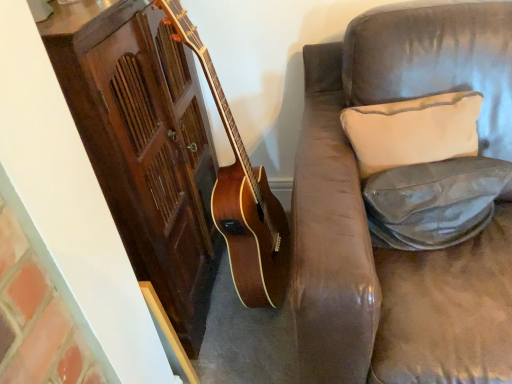
Question: Is white fabric pillow at upper right, marked as the first pillow in a top-to-bottom arrangement, next to leather-like gray pillow at right, the 2th pillow from the top, and touching it?

Choices:
 (A) yes
 (B) no

Answer: (A)

Question: Would you consider white fabric pillow at upper right, which appears as the second pillow when ordered from the bottom, to be distant from leather-like gray pillow at right, the 2th pillow from the top?

Choices:
 (A) yes
 (B) no

Answer: (B)

Question: From a real-world perspective, is white fabric pillow at upper right, marked as the first pillow in a top-to-bottom arrangement, physically above leather-like gray pillow at right, marked as the 1th pillow in a bottom-to-top arrangement?

Choices:
 (A) yes
 (B) no

Answer: (A)

Question: Is white fabric pillow at upper right, which appears as the second pillow when ordered from the bottom, at the right side of leather-like gray pillow at right, marked as the 1th pillow in a bottom-to-top arrangement?

Choices:
 (A) yes
 (B) no

Answer: (B)

Question: Is white fabric pillow at upper right, marked as the first pillow in a top-to-bottom arrangement, looking in the opposite direction of leather-like gray pillow at right, marked as the 1th pillow in a bottom-to-top arrangement?

Choices:
 (A) no
 (B) yes

Answer: (A)

Question: Considering the relative sizes of white fabric pillow at upper right, marked as the first pillow in a top-to-bottom arrangement, and leather-like gray pillow at right, marked as the 1th pillow in a bottom-to-top arrangement, in the image provided, is white fabric pillow at upper right, marked as the first pillow in a top-to-bottom arrangement, taller than leather-like gray pillow at right, marked as the 1th pillow in a bottom-to-top arrangement,?

Choices:
 (A) no
 (B) yes

Answer: (B)

Question: Is white fabric pillow at upper right, marked as the first pillow in a top-to-bottom arrangement, completely or partially inside leather-like gray pillow at right, marked as the 1th pillow in a bottom-to-top arrangement?

Choices:
 (A) yes
 (B) no

Answer: (B)

Question: From the image's perspective, is leather-like gray pillow at right, marked as the 1th pillow in a bottom-to-top arrangement, above white fabric pillow at upper right, which appears as the second pillow when ordered from the bottom?

Choices:
 (A) yes
 (B) no

Answer: (B)

Question: Considering the relative positions of leather-like gray pillow at right, the 2th pillow from the top, and white fabric pillow at upper right, which appears as the second pillow when ordered from the bottom, in the image provided, is leather-like gray pillow at right, the 2th pillow from the top, to the left of white fabric pillow at upper right, which appears as the second pillow when ordered from the bottom, from the viewer's perspective?

Choices:
 (A) no
 (B) yes

Answer: (A)

Question: Can you confirm if leather-like gray pillow at right, marked as the 1th pillow in a bottom-to-top arrangement, is shorter than white fabric pillow at upper right, which appears as the second pillow when ordered from the bottom?

Choices:
 (A) yes
 (B) no

Answer: (A)

Question: From the image's perspective, would you say leather-like gray pillow at right, the 2th pillow from the top, is shown under white fabric pillow at upper right, marked as the first pillow in a top-to-bottom arrangement?

Choices:
 (A) yes
 (B) no

Answer: (A)

Question: Considering the relative positions of leather-like gray pillow at right, marked as the 1th pillow in a bottom-to-top arrangement, and white fabric pillow at upper right, which appears as the second pillow when ordered from the bottom, in the image provided, is leather-like gray pillow at right, marked as the 1th pillow in a bottom-to-top arrangement, in front of white fabric pillow at upper right, which appears as the second pillow when ordered from the bottom,?

Choices:
 (A) no
 (B) yes

Answer: (B)

Question: From the image's perspective, is white fabric pillow at upper right, which appears as the second pillow when ordered from the bottom, positioned above or below leather-like gray pillow at right, marked as the 1th pillow in a bottom-to-top arrangement?

Choices:
 (A) below
 (B) above

Answer: (B)